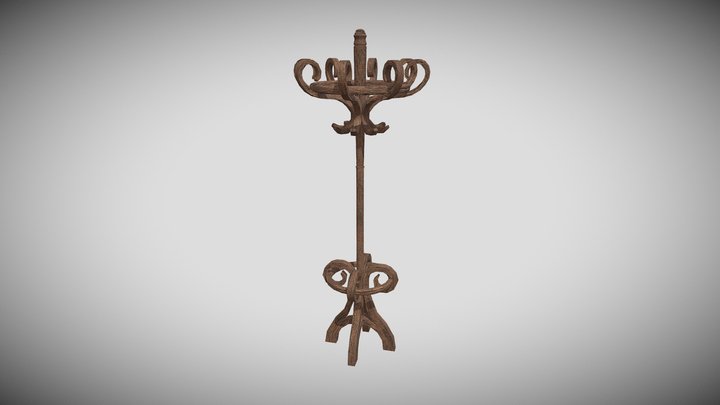
You are a GUI agent. You are given a task and a screenshot of the screen. Output one action in this format:
    pyautogui.click(x=<x>, y=<y>)
    Task: Click on the coat rack
    Image resolution: width=720 pixels, height=405 pixels.
    Given the screenshot: What is the action you would take?
    pyautogui.click(x=356, y=261)